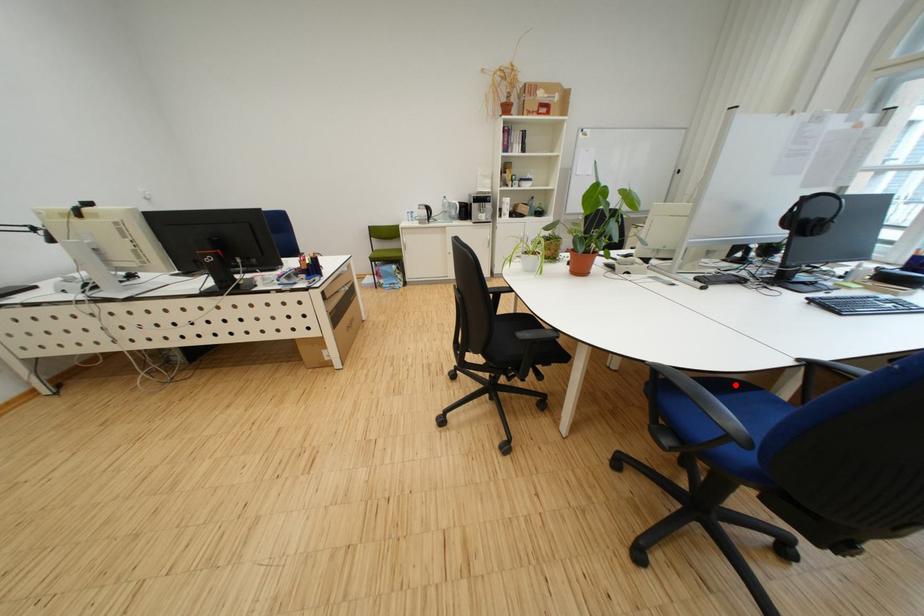
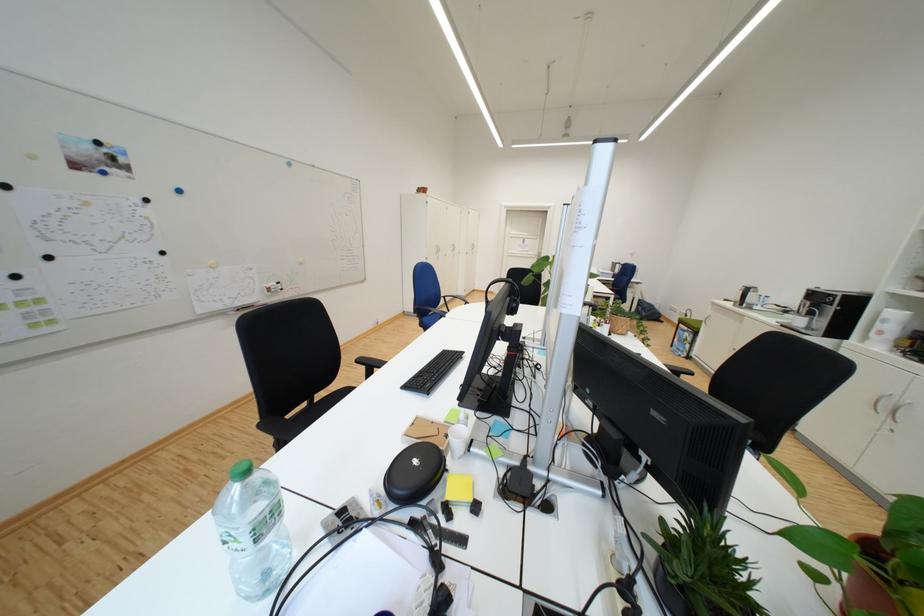
Question: I am providing you with two images of the same scene from different viewpoints. A red point is marked on the first image. At the location where the point appears in image 1, is it still visible in image 2?

Choices:
 (A) Yes
 (B) No

Answer: (B)